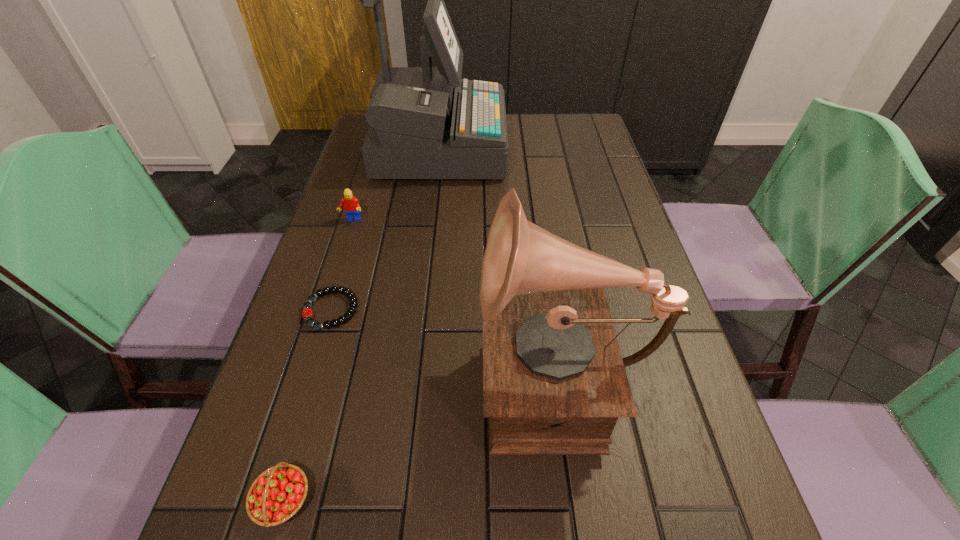
At what (x,y) coordinates should I click in order to perform the action: click on object present at the far left corner. Please return your answer as a coordinate pair (x, y). Image resolution: width=960 pixels, height=540 pixels. Looking at the image, I should click on (426, 122).

Image resolution: width=960 pixels, height=540 pixels. In the image, there is a desktop. What are the coordinates of `free region at the left edge` in the screenshot? It's located at (349, 260).

Image resolution: width=960 pixels, height=540 pixels. I want to click on vacant space at the right edge of the desktop, so click(x=596, y=194).

Image resolution: width=960 pixels, height=540 pixels. Find the location of `free space at the far right corner`. free space at the far right corner is located at coordinates (588, 119).

Where is `free space between the record player and the Lego`? The height and width of the screenshot is (540, 960). free space between the record player and the Lego is located at coordinates (455, 296).

Find the location of a particular element. vacant space that's between the bracelet and the third tallest object is located at coordinates (342, 265).

Find the location of `empty location between the bracelet and the farthest object`. empty location between the bracelet and the farthest object is located at coordinates (384, 229).

Find the location of `free space that is in between the strawberry and the record player`. free space that is in between the strawberry and the record player is located at coordinates (420, 436).

Identify the location of free area in between the record player and the nearest object. This screenshot has height=540, width=960. (420, 436).

At what (x,y) coordinates should I click in order to perform the action: click on free point between the record player and the second shortest object. Please return your answer as a coordinate pair (x, y). Looking at the image, I should click on (420, 436).